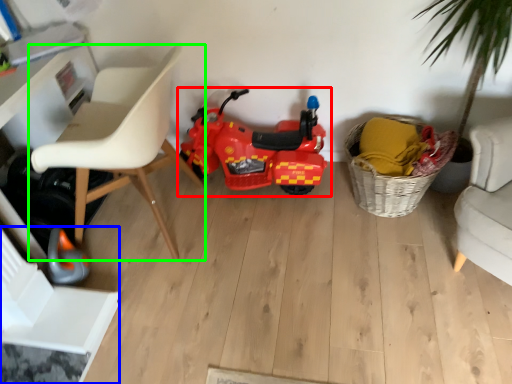
Question: Which object is positioned closest to land vehicle (highlighted by a red box)? Select from swivel chair (highlighted by a blue box) and chair (highlighted by a green box).

Choices:
 (A) swivel chair
 (B) chair

Answer: (B)